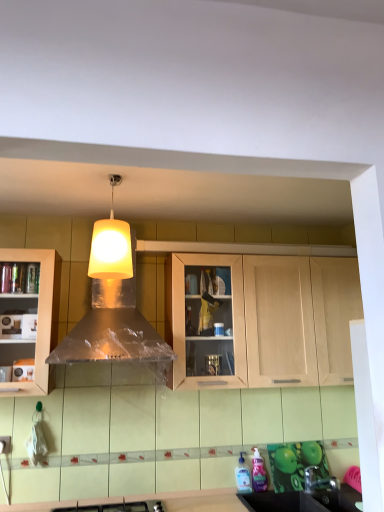
Question: Considering the positions of satin nickel faucet at lower right and white matte lampshade at upper center in the image, is satin nickel faucet at lower right taller or shorter than white matte lampshade at upper center?

Choices:
 (A) tall
 (B) short

Answer: (B)

Question: From the image's perspective, relative to white matte lampshade at upper center, is satin nickel faucet at lower right above or below?

Choices:
 (A) below
 (B) above

Answer: (A)

Question: Which is nearer to the metallic silver hood at center?

Choices:
 (A) satin nickel faucet at lower right
 (B) translucent plastic bottle at lower center, acting as the first bottle starting from the right
 (C) translucent plastic bottle at lower center, which ranks as the second bottle in right-to-left order
 (D) light wood cabinet at center
 (E) black plastic sink at lower right

Answer: (D)

Question: Which object is positioned farthest from the satin nickel faucet at lower right?

Choices:
 (A) white matte lampshade at upper center
 (B) metallic silver hood at center
 (C) light wood cabinet at center
 (D) translucent plastic bottle at lower center, positioned as the 1th bottle in left-to-right order
 (E) black plastic sink at lower right

Answer: (A)